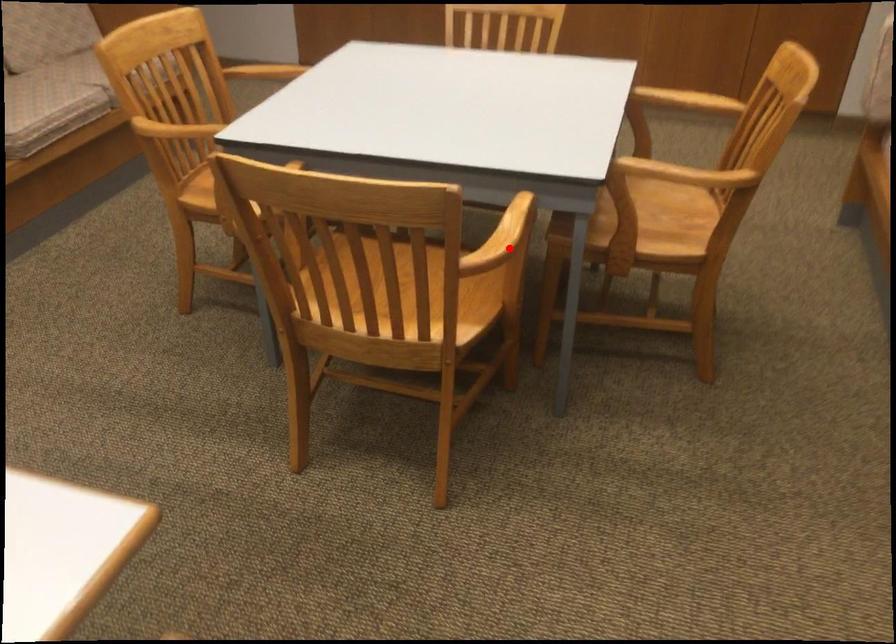
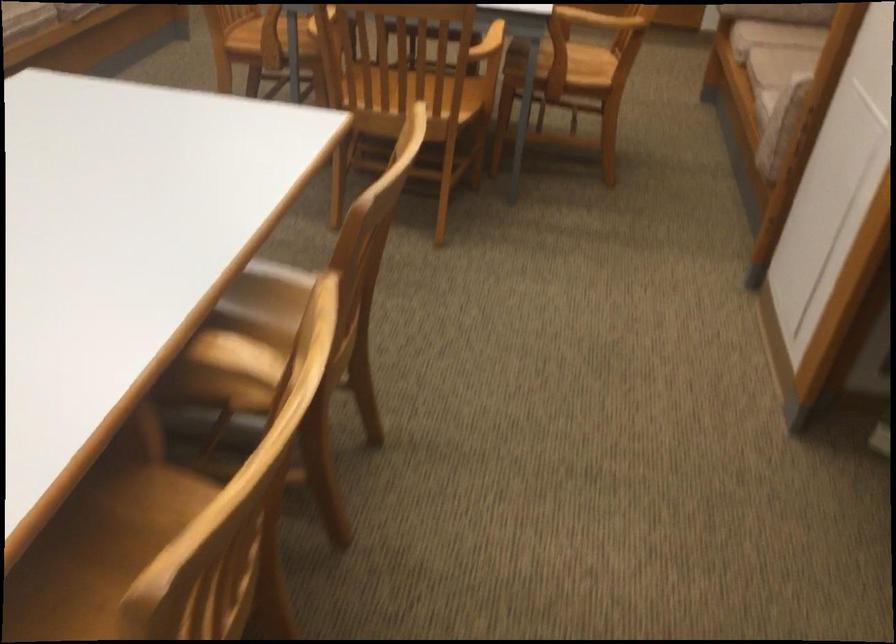
Question: A red point is marked in image1. In image2, is the corresponding 3D point closer to the camera or farther? Reply with the corresponding letter.

Choices:
 (A) The corresponding 3D point is closer.
 (B) The corresponding 3D point is farther.

Answer: (B)